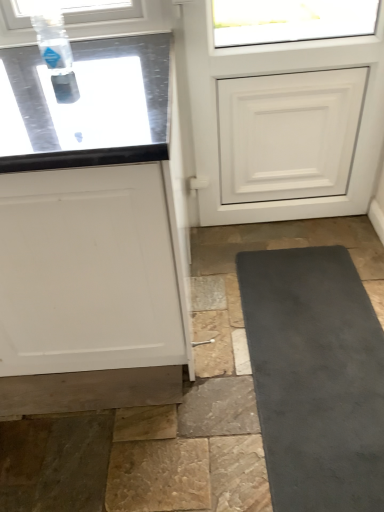
Question: Does transparent plastic bottle at upper left turn towards white matte cabinet at left?

Choices:
 (A) yes
 (B) no

Answer: (B)

Question: Does transparent plastic bottle at upper left have a lesser height compared to white matte cabinet at left?

Choices:
 (A) yes
 (B) no

Answer: (A)

Question: From the image's perspective, would you say transparent plastic bottle at upper left is shown under white matte cabinet at left?

Choices:
 (A) yes
 (B) no

Answer: (B)

Question: Is transparent plastic bottle at upper left wider than white matte cabinet at left?

Choices:
 (A) no
 (B) yes

Answer: (A)

Question: Is the depth of transparent plastic bottle at upper left greater than that of white matte cabinet at left?

Choices:
 (A) no
 (B) yes

Answer: (B)

Question: Considering the relative positions of transparent plastic bottle at upper left and white matte cabinet at left in the image provided, is transparent plastic bottle at upper left in front of white matte cabinet at left?

Choices:
 (A) yes
 (B) no

Answer: (B)

Question: Considering the relative sizes of white matte cabinet at left and transparent plastic bottle at upper left in the image provided, is white matte cabinet at left shorter than transparent plastic bottle at upper left?

Choices:
 (A) yes
 (B) no

Answer: (B)

Question: Is white matte cabinet at left placed right next to transparent plastic bottle at upper left?

Choices:
 (A) yes
 (B) no

Answer: (B)

Question: Is white matte cabinet at left positioned before transparent plastic bottle at upper left?

Choices:
 (A) yes
 (B) no

Answer: (A)

Question: From a real-world perspective, is white matte cabinet at left beneath transparent plastic bottle at upper left?

Choices:
 (A) no
 (B) yes

Answer: (B)

Question: Can you confirm if white matte cabinet at left is wider than transparent plastic bottle at upper left?

Choices:
 (A) no
 (B) yes

Answer: (B)

Question: From the image's perspective, is white matte cabinet at left above transparent plastic bottle at upper left?

Choices:
 (A) yes
 (B) no

Answer: (B)

Question: Is white matte cabinet at left at the right side of white matte door at upper center?

Choices:
 (A) no
 (B) yes

Answer: (A)